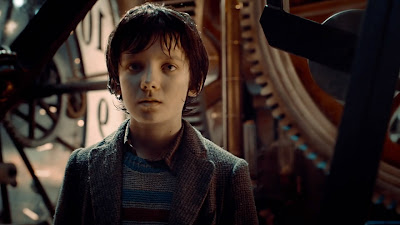
I want to click on white clock face, so click(x=95, y=66).